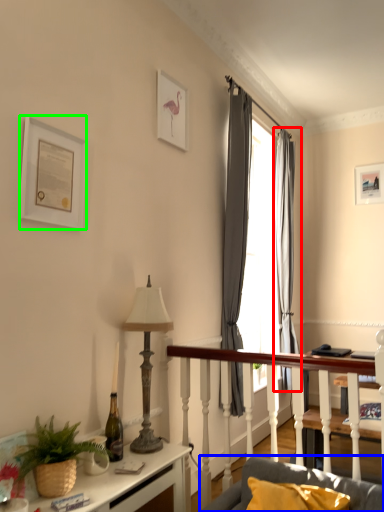
Question: Which object is the closest to the curtain (highlighted by a red box)? Choose among these: studio couch (highlighted by a blue box) or picture frame (highlighted by a green box).

Choices:
 (A) studio couch
 (B) picture frame

Answer: (A)